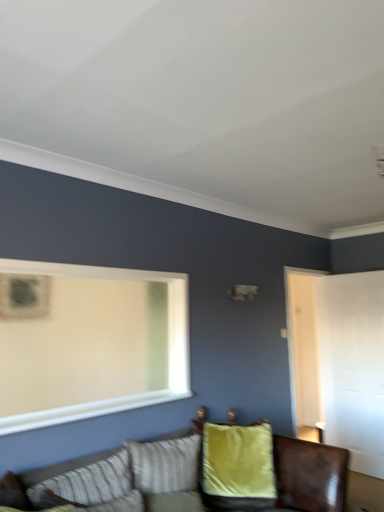
Question: Can you confirm if striped fabric pillow at lower left, acting as the 1th pillow starting from the left, is smaller than velvet green couch at lower center?

Choices:
 (A) yes
 (B) no

Answer: (A)

Question: Is striped fabric pillow at lower left, which is counted as the 1th pillow, starting from the front, to the left of velvet green couch at lower center from the viewer's perspective?

Choices:
 (A) yes
 (B) no

Answer: (A)

Question: Is striped fabric pillow at lower left, acting as the 1th pillow starting from the left, facing towards velvet green couch at lower center?

Choices:
 (A) no
 (B) yes

Answer: (B)

Question: From the image's perspective, does striped fabric pillow at lower left, acting as the 1th pillow starting from the left, appear higher than velvet green couch at lower center?

Choices:
 (A) no
 (B) yes

Answer: (B)

Question: Can you confirm if striped fabric pillow at lower left, which is counted as the 1th pillow, starting from the front, is taller than velvet green couch at lower center?

Choices:
 (A) yes
 (B) no

Answer: (B)

Question: From a real-world perspective, is velvet green couch at lower center above or below striped fabric pillow at lower left, acting as the 1th pillow starting from the left?

Choices:
 (A) above
 (B) below

Answer: (B)

Question: Which is correct: velvet green couch at lower center is inside striped fabric pillow at lower left, which is the second pillow in right-to-left order, or outside of it?

Choices:
 (A) outside
 (B) inside

Answer: (A)

Question: Considering the positions of velvet green couch at lower center and striped fabric pillow at lower left, acting as the 1th pillow starting from the left, in the image, is velvet green couch at lower center bigger or smaller than striped fabric pillow at lower left, acting as the 1th pillow starting from the left,?

Choices:
 (A) big
 (B) small

Answer: (A)

Question: Considering the positions of velvet green couch at lower center and striped fabric pillow at lower left, which is counted as the 1th pillow, starting from the front, in the image, is velvet green couch at lower center wider or thinner than striped fabric pillow at lower left, which is counted as the 1th pillow, starting from the front,?

Choices:
 (A) thin
 (B) wide

Answer: (B)

Question: From the image's perspective, is striped fabric pillow at lower left, which is counted as the 1th pillow, starting from the front, above or below velvet yellow pillow at center, which is counted as the 2th pillow, starting from the left?

Choices:
 (A) above
 (B) below

Answer: (A)

Question: From their relative heights in the image, would you say striped fabric pillow at lower left, which is counted as the 1th pillow, starting from the front, is taller or shorter than velvet yellow pillow at center, the 1th pillow from the right?

Choices:
 (A) tall
 (B) short

Answer: (B)

Question: Is striped fabric pillow at lower left, the 2th pillow in the back-to-front sequence, bigger or smaller than velvet yellow pillow at center, marked as the 1th pillow in a back-to-front arrangement?

Choices:
 (A) small
 (B) big

Answer: (A)

Question: Would you say striped fabric pillow at lower left, which is the second pillow in right-to-left order, is to the left or to the right of velvet yellow pillow at center, the 1th pillow from the right, in the picture?

Choices:
 (A) right
 (B) left

Answer: (B)

Question: Considering the positions of striped fabric pillow at lower left, which is the second pillow in right-to-left order, and velvet green couch at lower center in the image, is striped fabric pillow at lower left, which is the second pillow in right-to-left order, taller or shorter than velvet green couch at lower center?

Choices:
 (A) tall
 (B) short

Answer: (B)

Question: Is point (46, 485) closer or farther from the camera than point (218, 485)?

Choices:
 (A) closer
 (B) farther

Answer: (A)